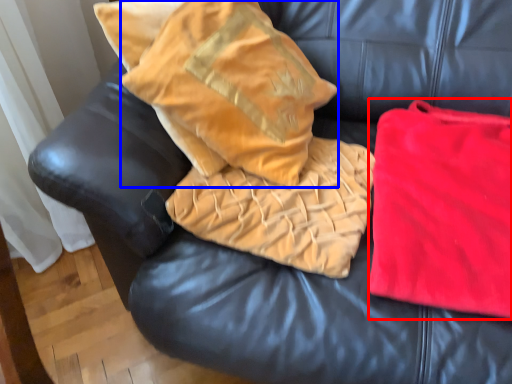
Question: Which object is closer to the camera taking this photo, material (highlighted by a red box) or throw pillow (highlighted by a blue box)?

Choices:
 (A) material
 (B) throw pillow

Answer: (A)